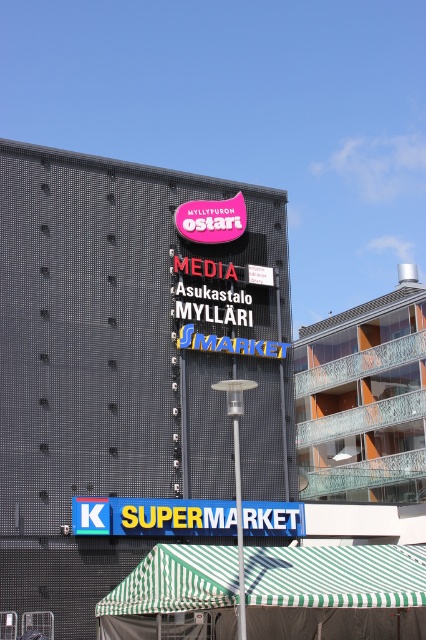
You are standing in front of the building and want to locate the orange glass balcony at upper right and the blue plastic sign at bottom. Which object is located to the right of the other?

The orange glass balcony at upper right is positioned on the right side of blue plastic sign at bottom, so the orange glass balcony at upper right is to the right of the blue plastic sign at bottom.

You are standing in front of the building and want to go to the Smarket supermarket. The entrance to the supermarket is at point [143,637]. There is another entrance at point [210,208]. Which entrance should you go to if you want to enter the supermarket?

You should go to the entrance at point [143,637] because it is the entrance to the Smarket supermarket, which is the supermarket.